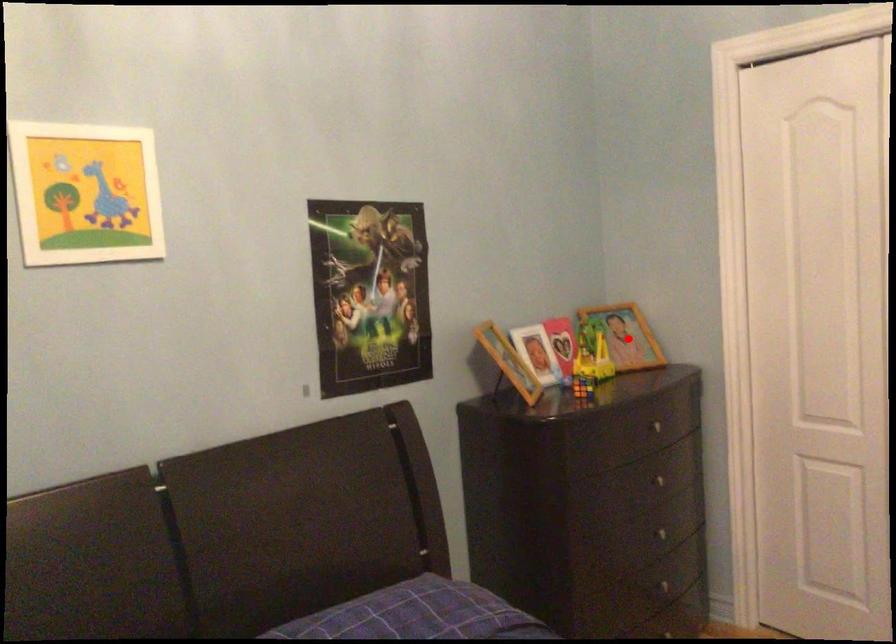
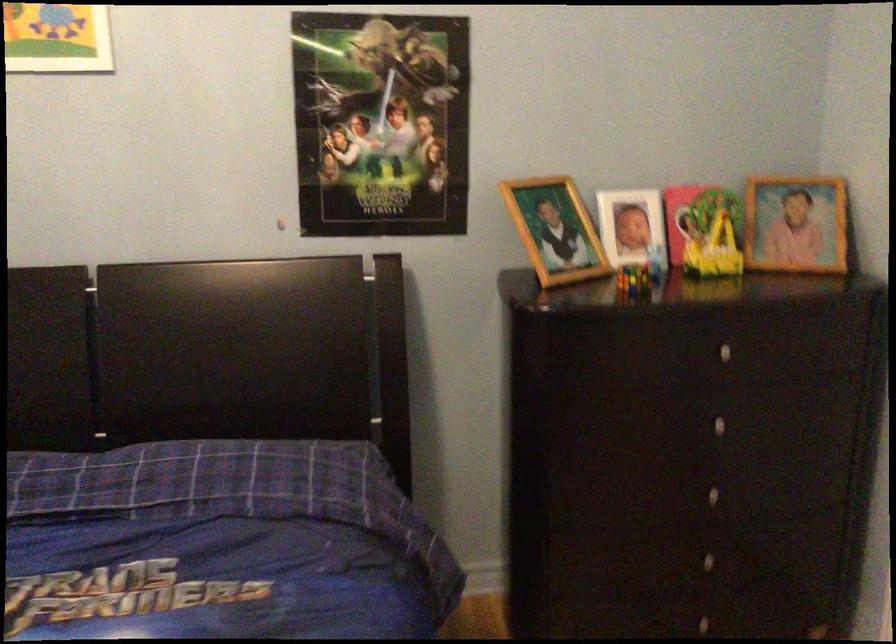
Locate, in the second image, the point that corresponds to the highlighted location in the first image.

(796, 223)